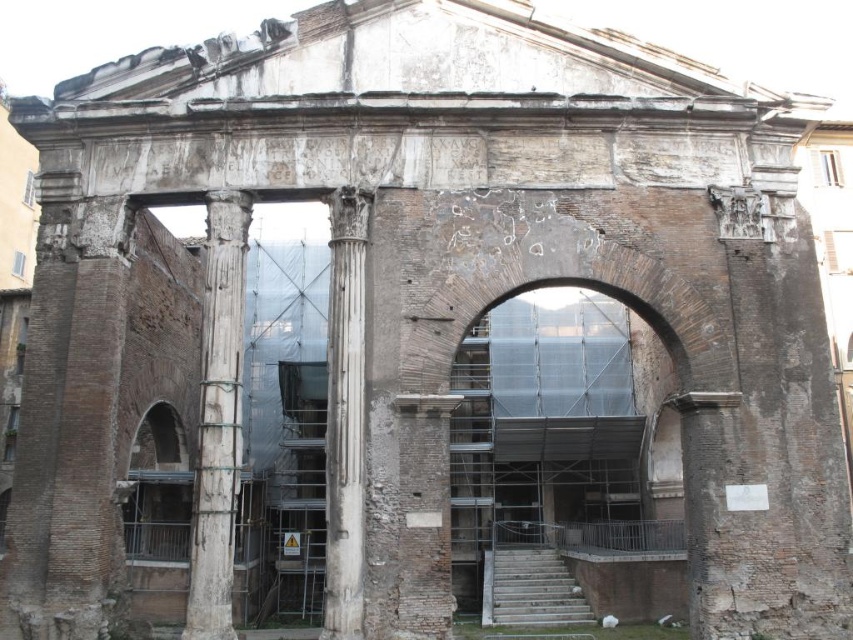
Is white marble column at left above white marble column at center?

Correct, white marble column at left is located above white marble column at center.

Is white marble column at left in front of white marble column at center?

No, white marble column at left is behind white marble column at center.

Who is more distant from viewer, (x=212, y=429) or (x=350, y=563)?

Positioned behind is point (x=212, y=429).

The height and width of the screenshot is (640, 853). I want to click on white marble column at left, so click(x=218, y=419).